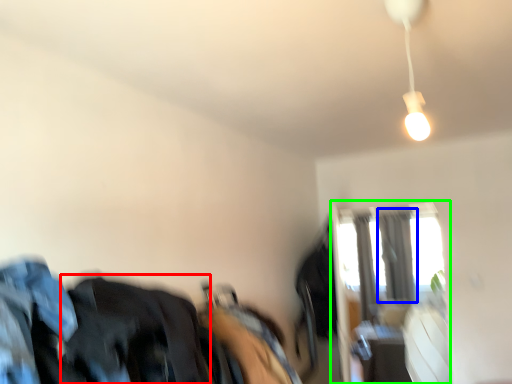
Question: Considering the real-world distances, which object is farthest from clothing (highlighted by a red box)? curtain (highlighted by a blue box) or window (highlighted by a green box)?

Choices:
 (A) curtain
 (B) window

Answer: (A)